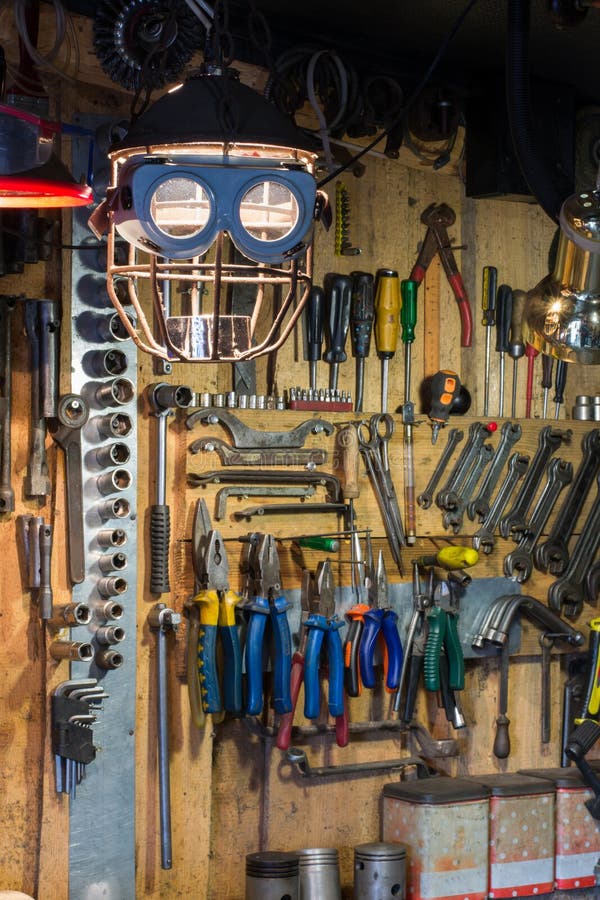
The width and height of the screenshot is (600, 900). I want to click on light fixture, so click(x=230, y=148).